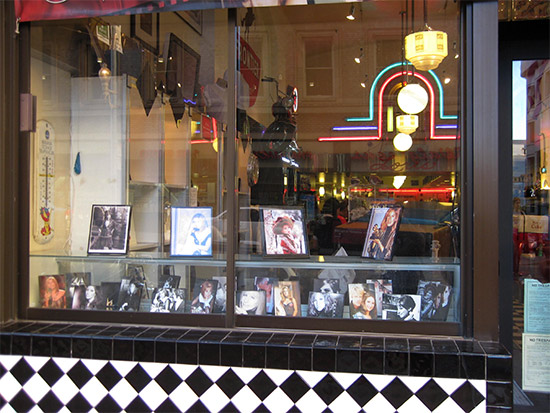
Image resolution: width=550 pixels, height=413 pixels. In order to click on door in this screenshot , I will do 526,230.